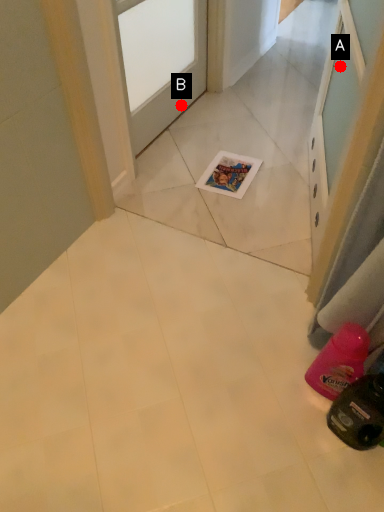
Question: Two points are circled on the image, labeled by A and B beside each circle. Which point is farther from the camera taking this photo?

Choices:
 (A) A is further
 (B) B is further

Answer: (B)